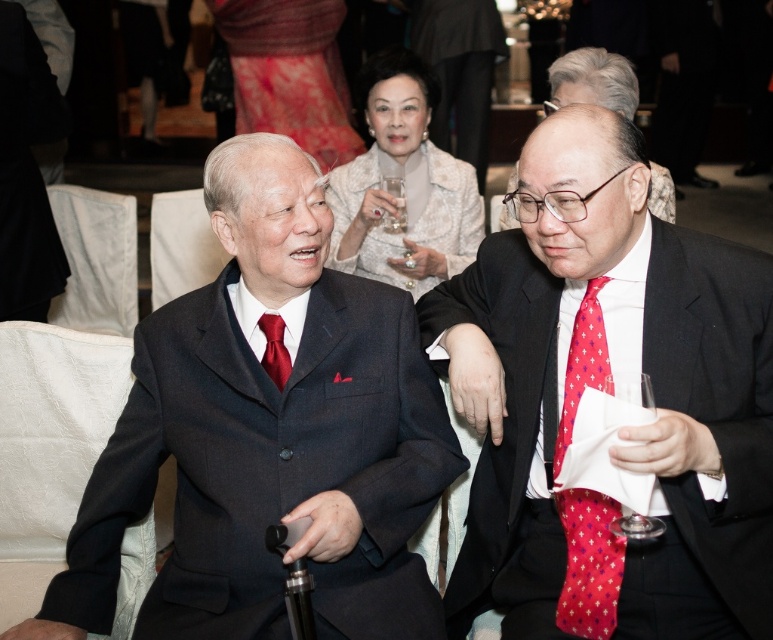
Question: Considering the real-world distances, which object is closest to the white textured jacket at upper center?

Choices:
 (A) matte black suit at center
 (B) red silk tie at right

Answer: (A)

Question: Which of the following is the closest to the observer?

Choices:
 (A) white textured jacket at upper center
 (B) silky red dress at upper center

Answer: (A)

Question: Is white textured jacket at upper center wider than clear glass wine glass at right?

Choices:
 (A) yes
 (B) no

Answer: (A)

Question: Does matte black suit at center have a lesser width compared to red silk tie at right?

Choices:
 (A) yes
 (B) no

Answer: (B)

Question: Is white textured jacket at upper center bigger than matte silk tie at center?

Choices:
 (A) yes
 (B) no

Answer: (A)

Question: Among these points, which one is farthest from the camera?

Choices:
 (A) (284, 365)
 (B) (656, 532)
 (C) (237, 97)

Answer: (C)